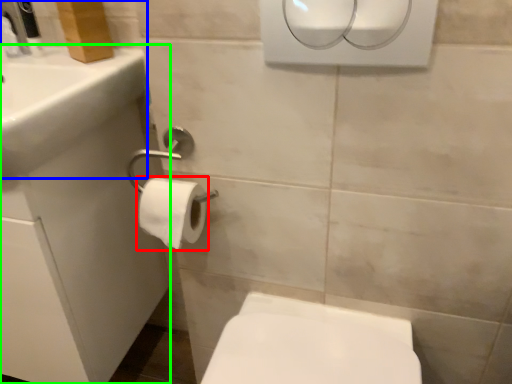
Question: Based on their relative distances, which object is nearer to toilet paper (highlighted by a red box)? Choose from sink (highlighted by a blue box) and porcelain (highlighted by a green box).

Choices:
 (A) sink
 (B) porcelain

Answer: (A)